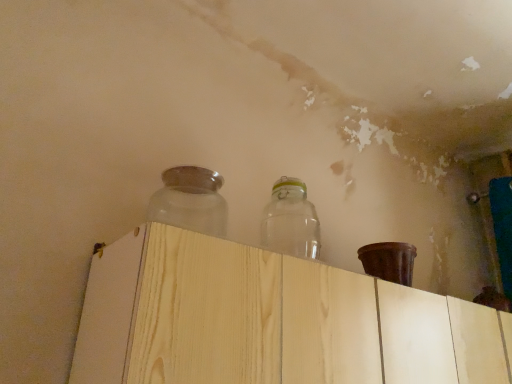
What do you see at coordinates (291, 220) in the screenshot? I see `transparent glass jar at upper center, the 2th bottle when ordered from left to right` at bounding box center [291, 220].

Where is `transparent glass jar at upper center, arranged as the first bottle when viewed from the right`? transparent glass jar at upper center, arranged as the first bottle when viewed from the right is located at coordinates (291, 220).

Describe the element at coordinates (270, 320) in the screenshot. I see `light wood dresser at center` at that location.

At what (x,y) coordinates should I click in order to perform the action: click on frosted glass jar at upper center, the 1th bottle viewed from the left. Please return your answer as a coordinate pair (x, y). Looking at the image, I should click on (190, 201).

From the image's perspective, is frosted glass jar at upper center, the 1th bottle viewed from the left, below light wood dresser at center?

Actually, frosted glass jar at upper center, the 1th bottle viewed from the left, appears above light wood dresser at center in the image.

Measure the distance from frosted glass jar at upper center, the 1th bottle viewed from the left, to light wood dresser at center.

A distance of 14.75 inches exists between frosted glass jar at upper center, the 1th bottle viewed from the left, and light wood dresser at center.

Is light wood dresser at center surrounded by frosted glass jar at upper center, the 1th bottle viewed from the left?

No, light wood dresser at center is not a part of frosted glass jar at upper center, the 1th bottle viewed from the left.

Which is in front, point (224, 231) or point (332, 267)?

Point (332, 267)

Which of these two, frosted glass jar at upper center, the 1th bottle viewed from the left, or transparent glass jar at upper center, the 2th bottle when ordered from left to right, is smaller?

frosted glass jar at upper center, the 1th bottle viewed from the left.

From the image's perspective, who appears lower, frosted glass jar at upper center, the 1th bottle viewed from the left, or transparent glass jar at upper center, the 2th bottle when ordered from left to right?

From the image's view, transparent glass jar at upper center, the 2th bottle when ordered from left to right, is below.

Image resolution: width=512 pixels, height=384 pixels. In the image, there is a transparent glass jar at upper center, the 2th bottle when ordered from left to right. In order to click on bottle above it (from the image's perspective) in this screenshot , I will do `click(190, 201)`.

From a real-world perspective, who is located higher, frosted glass jar at upper center, the 1th bottle viewed from the left, or transparent glass jar at upper center, the 2th bottle when ordered from left to right?

From a 3D spatial view, transparent glass jar at upper center, the 2th bottle when ordered from left to right, is above.

Which is more to the left, light wood dresser at center or frosted glass jar at upper center, positioned as the second bottle in right-to-left order?

frosted glass jar at upper center, positioned as the second bottle in right-to-left order, is more to the left.

Is the depth of light wood dresser at center less than that of frosted glass jar at upper center, positioned as the second bottle in right-to-left order?

That is True.

From a real-world perspective, which is physically above, light wood dresser at center or frosted glass jar at upper center, positioned as the second bottle in right-to-left order?

From a 3D spatial view, frosted glass jar at upper center, positioned as the second bottle in right-to-left order, is above.

Which is further, (369, 341) or (190, 199)?

The point (190, 199) is farther from the camera.

From a real-world perspective, between transparent glass jar at upper center, arranged as the first bottle when viewed from the right, and frosted glass jar at upper center, positioned as the second bottle in right-to-left order, who is vertically lower?

In real-world perspective, frosted glass jar at upper center, positioned as the second bottle in right-to-left order, is lower.

Is frosted glass jar at upper center, the 1th bottle viewed from the left, at the back of transparent glass jar at upper center, the 2th bottle when ordered from left to right?

No.

Measure the distance from transparent glass jar at upper center, the 2th bottle when ordered from left to right, to frosted glass jar at upper center, positioned as the second bottle in right-to-left order.

transparent glass jar at upper center, the 2th bottle when ordered from left to right, is 9.40 inches from frosted glass jar at upper center, positioned as the second bottle in right-to-left order.

Considering the sizes of objects transparent glass jar at upper center, arranged as the first bottle when viewed from the right, and frosted glass jar at upper center, the 1th bottle viewed from the left, in the image provided, who is shorter, transparent glass jar at upper center, arranged as the first bottle when viewed from the right, or frosted glass jar at upper center, the 1th bottle viewed from the left,?

With less height is frosted glass jar at upper center, the 1th bottle viewed from the left.

Which point is more forward, (151, 287) or (285, 239)?

Point (151, 287)

Is light wood dresser at center in contact with transparent glass jar at upper center, arranged as the first bottle when viewed from the right?

No, light wood dresser at center is not in contact with transparent glass jar at upper center, arranged as the first bottle when viewed from the right.

Based on the photo, from a real-world perspective, is light wood dresser at center physically above transparent glass jar at upper center, arranged as the first bottle when viewed from the right?

Actually, light wood dresser at center is physically below transparent glass jar at upper center, arranged as the first bottle when viewed from the right, in the real world.

From the picture: Are transparent glass jar at upper center, arranged as the first bottle when viewed from the right, and light wood dresser at center making contact?

transparent glass jar at upper center, arranged as the first bottle when viewed from the right, and light wood dresser at center are not in contact.

Is transparent glass jar at upper center, the 2th bottle when ordered from left to right, turned away from light wood dresser at center?

No.

Considering the sizes of objects transparent glass jar at upper center, the 2th bottle when ordered from left to right, and light wood dresser at center in the image provided, who is smaller, transparent glass jar at upper center, the 2th bottle when ordered from left to right, or light wood dresser at center?

→ With smaller size is transparent glass jar at upper center, the 2th bottle when ordered from left to right.

Which is farther from the camera, (298, 184) or (166, 354)?

The point (298, 184) is more distant.

From the light wood dresser at center, count 1st bottles backward and point to it. Please provide its 2D coordinates.

[(190, 201)]

Find the location of a particular element. The image size is (512, 384). bottle below the transparent glass jar at upper center, arranged as the first bottle when viewed from the right (from a real-world perspective) is located at coordinates (190, 201).

Estimate the real-world distances between objects in this image. Which object is closer to frosted glass jar at upper center, positioned as the second bottle in right-to-left order, transparent glass jar at upper center, the 2th bottle when ordered from left to right, or light wood dresser at center?

The object closer to frosted glass jar at upper center, positioned as the second bottle in right-to-left order, is transparent glass jar at upper center, the 2th bottle when ordered from left to right.

Which object lies further to the anchor point light wood dresser at center, transparent glass jar at upper center, arranged as the first bottle when viewed from the right, or frosted glass jar at upper center, positioned as the second bottle in right-to-left order?

Based on the image, transparent glass jar at upper center, arranged as the first bottle when viewed from the right, appears to be further to light wood dresser at center.

Looking at the image, which one is located further to light wood dresser at center, frosted glass jar at upper center, positioned as the second bottle in right-to-left order, or transparent glass jar at upper center, arranged as the first bottle when viewed from the right?

The object further to light wood dresser at center is transparent glass jar at upper center, arranged as the first bottle when viewed from the right.

Based on their spatial positions, is light wood dresser at center or frosted glass jar at upper center, positioned as the second bottle in right-to-left order, closer to transparent glass jar at upper center, the 2th bottle when ordered from left to right?

frosted glass jar at upper center, positioned as the second bottle in right-to-left order, lies closer to transparent glass jar at upper center, the 2th bottle when ordered from left to right, than the other object.

Looking at the image, which one is located closer to frosted glass jar at upper center, positioned as the second bottle in right-to-left order, light wood dresser at center or transparent glass jar at upper center, arranged as the first bottle when viewed from the right?

The object closer to frosted glass jar at upper center, positioned as the second bottle in right-to-left order, is transparent glass jar at upper center, arranged as the first bottle when viewed from the right.

Looking at the image, which one is located closer to transparent glass jar at upper center, the 2th bottle when ordered from left to right, frosted glass jar at upper center, the 1th bottle viewed from the left, or light wood dresser at center?

frosted glass jar at upper center, the 1th bottle viewed from the left, lies closer to transparent glass jar at upper center, the 2th bottle when ordered from left to right, than the other object.

I want to click on bottle between frosted glass jar at upper center, positioned as the second bottle in right-to-left order, and light wood dresser at center, in the horizontal direction, so (x=291, y=220).